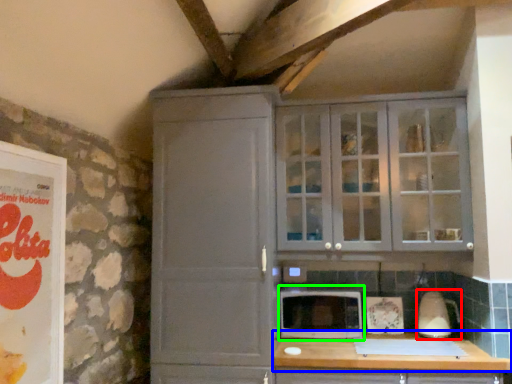
Question: Which object is positioned closest to appliance (highlighted by a red box)? Select from countertop (highlighted by a blue box) and microwave oven (highlighted by a green box).

Choices:
 (A) countertop
 (B) microwave oven

Answer: (A)